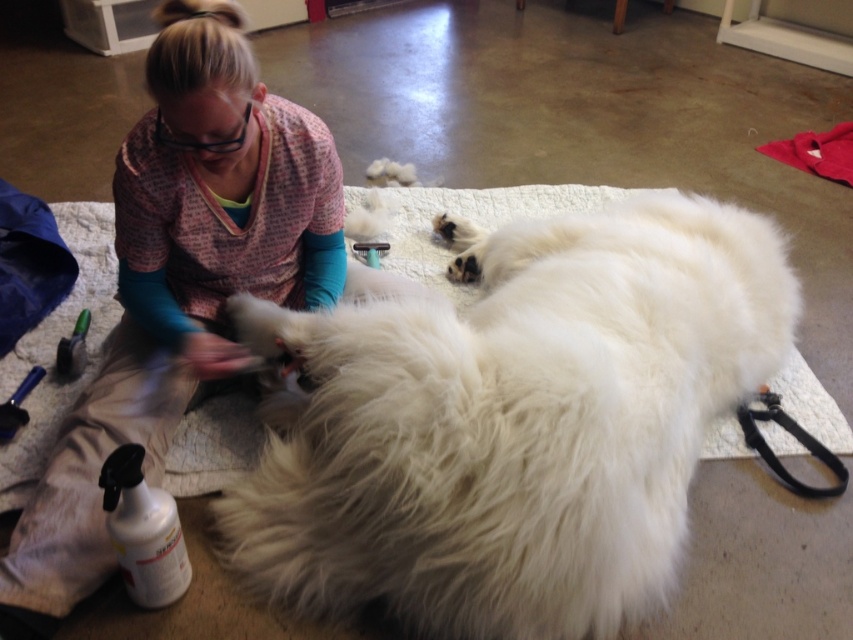
Question: Does pink fabric at center have a larger size compared to black rubber leash at lower right?

Choices:
 (A) yes
 (B) no

Answer: (A)

Question: Which of the following is the closest to the observer?

Choices:
 (A) (764, 404)
 (B) (251, 273)
 (C) (317, 436)

Answer: (C)

Question: Is pink fabric at center smaller than black rubber leash at lower right?

Choices:
 (A) yes
 (B) no

Answer: (B)

Question: Which object is closer to the camera taking this photo?

Choices:
 (A) white fluffy dog at center
 (B) pink fabric at center

Answer: (A)

Question: Which point is farther to the camera?

Choices:
 (A) (193, 97)
 (B) (772, 470)
 (C) (689, 262)

Answer: (B)

Question: Does white fluffy dog at center come behind pink fabric at center?

Choices:
 (A) no
 (B) yes

Answer: (A)